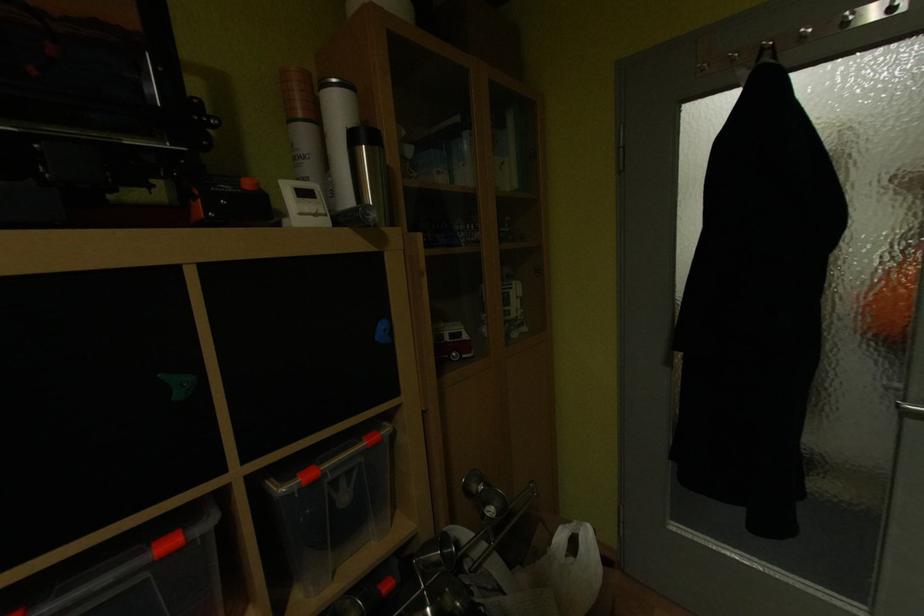
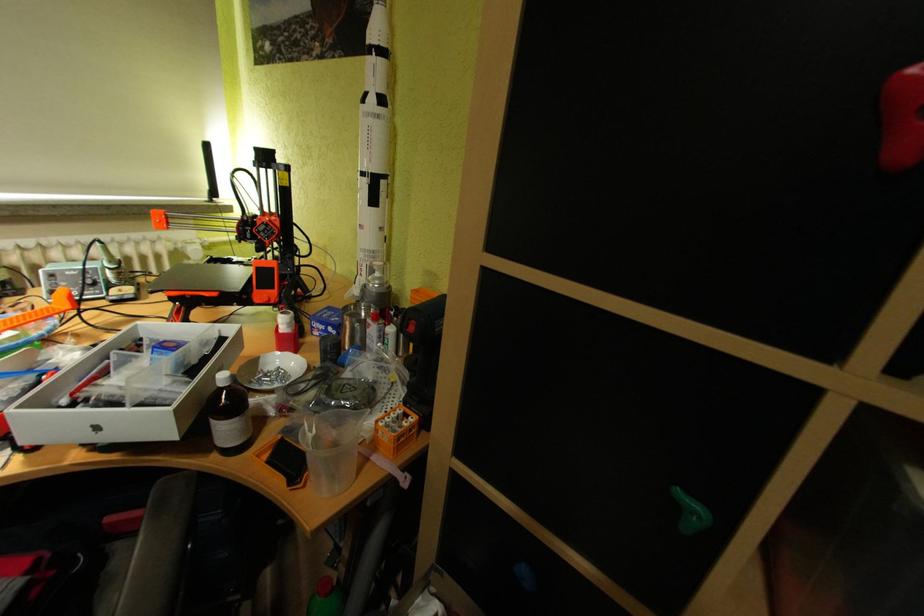
First-person continuous shooting, in which direction is the camera rotating?

The camera's rotation is toward left-down.